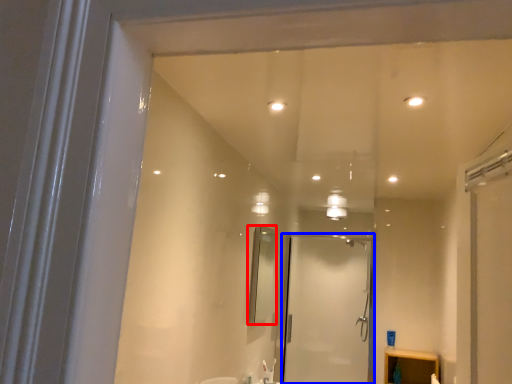
Question: Which of the following is the closest to the observer, mirror (highlighted by a red box) or screen door (highlighted by a blue box)?

Choices:
 (A) mirror
 (B) screen door

Answer: (A)